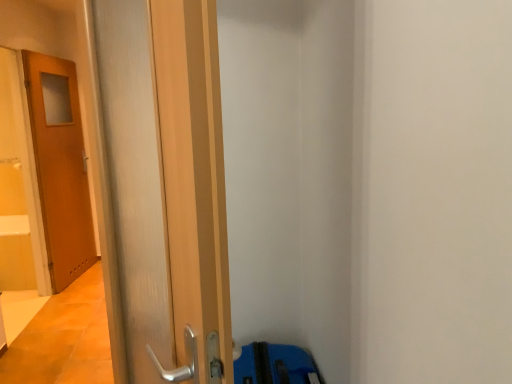
Question: Is wooden door at left, the second door in the back-to-front sequence, wider or thinner than wooden door at left, marked as the second door in a front-to-back arrangement?

Choices:
 (A) thin
 (B) wide

Answer: (B)

Question: In terms of size, does wooden door at left, the second door in the back-to-front sequence, appear bigger or smaller than wooden door at left, positioned as the 1th door in left-to-right order?

Choices:
 (A) big
 (B) small

Answer: (B)

Question: Considering the positions of wooden door at left, the first door when ordered from front to back, and wooden door at left, positioned as the 1th door in left-to-right order, in the image, is wooden door at left, the first door when ordered from front to back, taller or shorter than wooden door at left, positioned as the 1th door in left-to-right order,?

Choices:
 (A) tall
 (B) short

Answer: (B)

Question: From the image's perspective, is wooden door at left, marked as the second door in a front-to-back arrangement, above or below wooden door at left, the second door in the back-to-front sequence?

Choices:
 (A) below
 (B) above

Answer: (B)

Question: Looking at the image, does wooden door at left, marked as the second door in a front-to-back arrangement, seem bigger or smaller compared to wooden door at left, the first door when ordered from front to back?

Choices:
 (A) small
 (B) big

Answer: (B)

Question: In terms of height, does wooden door at left, the second door when ordered from right to left, look taller or shorter compared to wooden door at left, the second door in the back-to-front sequence?

Choices:
 (A) short
 (B) tall

Answer: (B)

Question: Would you say wooden door at left, positioned as the 1th door in left-to-right order, is to the left or to the right of wooden door at left, the 1th door when ordered from right to left, in the picture?

Choices:
 (A) left
 (B) right

Answer: (A)